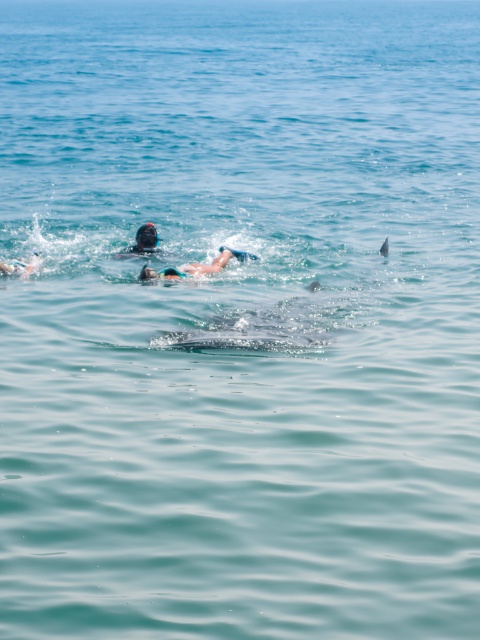
Consider the image. You are a photographer trying to capture the blue matte swimsuit at center and the matte black snorkel at upper center in the same frame. Based on their positions, which object should you focus on first to ensure both are in focus?

The blue matte swimsuit at center is in front of the matte black snorkel at upper center, so you should focus on the blue matte swimsuit at center first to ensure both are in focus.

Consider the image. You are a photographer trying to capture the matte black snorkel at upper center in the image. The camera is positioned at the point marked by coordinates point (142, 241). Can you see the matte black snorkel at upper center from this position?

Yes, the point (142, 241) marks the location of the matte black snorkel at upper center, so the photographer can see it from that position.